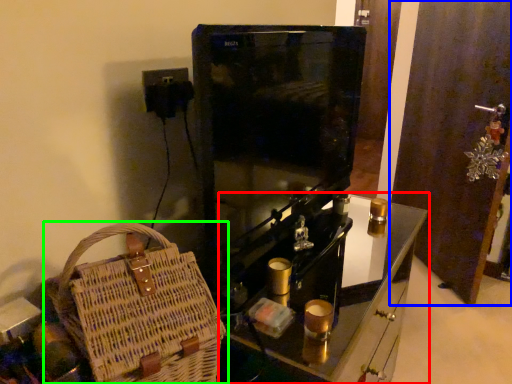
Question: Considering the real-world distances, which object is closest to furniture (highlighted by a red box)? door (highlighted by a blue box) or handbag (highlighted by a green box).

Choices:
 (A) door
 (B) handbag

Answer: (B)